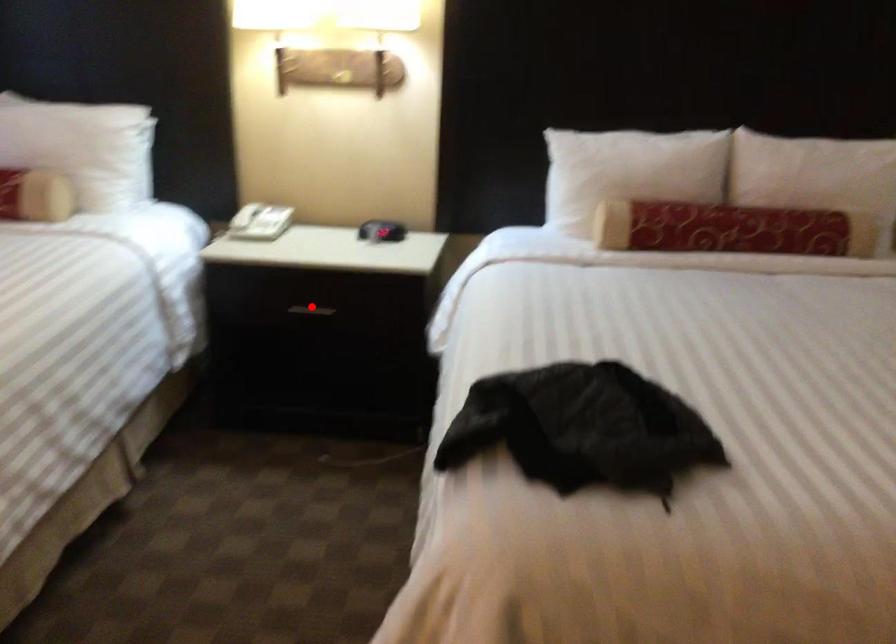
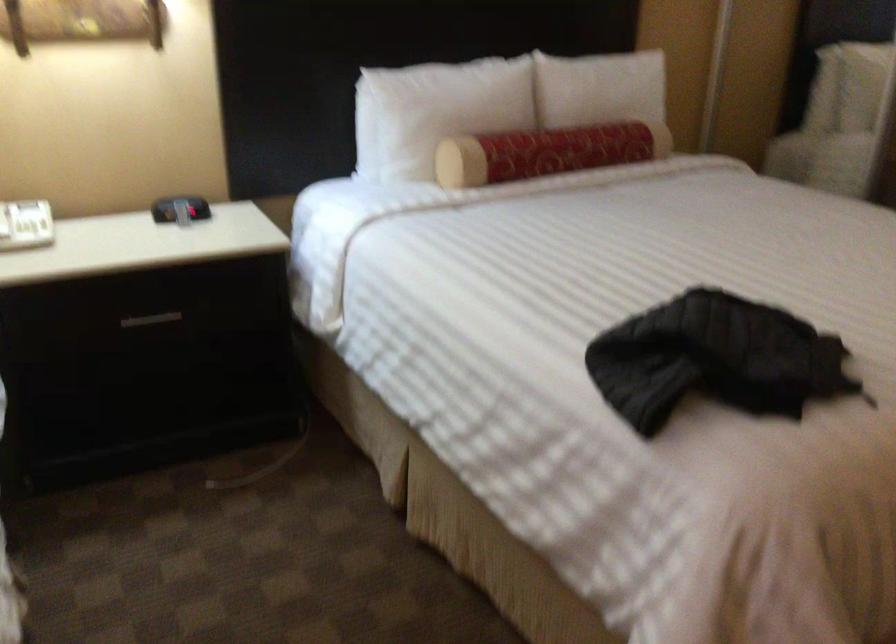
Question: I am providing you with two images of the same scene from different viewpoints. A red point is marked on the first image. Can you still see the location of the red point in image 2?

Choices:
 (A) Yes
 (B) No

Answer: (A)